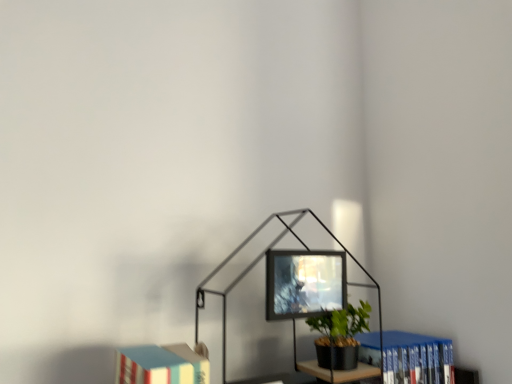
Looking at this image, in order to face hardcover book at lower left, which is the first book in front-to-back order, should I rotate leftwards or rightwards?

Turn left by 9.871 degrees to look at hardcover book at lower left, which is the first book in front-to-back order.

The image size is (512, 384). What do you see at coordinates (259, 261) in the screenshot?
I see `metallic black table lamp at center` at bounding box center [259, 261].

Locate an element on the screen. The height and width of the screenshot is (384, 512). hardcover book at lower left, which is the first book in front-to-back order is located at coordinates (161, 365).

Consider the image. Which object is positioned more to the right, blue hardcover book at lower right, the first book viewed from the back, or metallic black table lamp at center?

From the viewer's perspective, blue hardcover book at lower right, the first book viewed from the back, appears more on the right side.

Which of these two, blue hardcover book at lower right, positioned as the second book in front-to-back order, or metallic black table lamp at center, is thinner?

Thinner between the two is blue hardcover book at lower right, positioned as the second book in front-to-back order.

Measure the distance from blue hardcover book at lower right, the first book viewed from the back, to metallic black table lamp at center.

5.54 inches.

Could you tell me if blue hardcover book at lower right, positioned as the second book in front-to-back order, is turned towards metallic black table lamp at center?

No, blue hardcover book at lower right, positioned as the second book in front-to-back order, is not turned towards metallic black table lamp at center.

Between matte black monitor at center and metallic black table lamp at center, which one has smaller width?

matte black monitor at center.

Who is taller, matte black monitor at center or metallic black table lamp at center?

metallic black table lamp at center.

From the image's perspective, is matte black monitor at center positioned above or below metallic black table lamp at center?

Based on their image positions, matte black monitor at center is located above metallic black table lamp at center.

Is matte black monitor at center not near metallic black table lamp at center?

A: They are positioned close to each other.

Consider the image. Considering the relative sizes of matte black monitor at center and blue hardcover book at lower right, positioned as the 2th book in left-to-right order, in the image provided, is matte black monitor at center smaller than blue hardcover book at lower right, positioned as the 2th book in left-to-right order,?

Indeed, matte black monitor at center has a smaller size compared to blue hardcover book at lower right, positioned as the 2th book in left-to-right order.

Considering the sizes of objects matte black monitor at center and blue hardcover book at lower right, positioned as the second book in front-to-back order, in the image provided, who is shorter, matte black monitor at center or blue hardcover book at lower right, positioned as the second book in front-to-back order,?

matte black monitor at center is shorter.

Are matte black monitor at center and blue hardcover book at lower right, the 1th book from the right, located far from each other?

matte black monitor at center is near blue hardcover book at lower right, the 1th book from the right, not far away.

The width and height of the screenshot is (512, 384). Find the location of `book that appears behind the matte black monitor at center`. book that appears behind the matte black monitor at center is located at coordinates click(x=417, y=359).

Who is smaller, metallic black table lamp at center or matte black monitor at center?

Smaller between the two is matte black monitor at center.

Is metallic black table lamp at center at the right side of matte black monitor at center?

No.

Is metallic black table lamp at center next to matte black monitor at center and touching it?

Yes, metallic black table lamp at center is right next to matte black monitor at center and making contact.

In the scene shown: In the image, is blue hardcover book at lower right, the 1th book from the right, on the left side or the right side of hardcover book at lower left, which is the first book in front-to-back order?

blue hardcover book at lower right, the 1th book from the right, is to the right of hardcover book at lower left, which is the first book in front-to-back order.

Considering the sizes of blue hardcover book at lower right, positioned as the 2th book in left-to-right order, and hardcover book at lower left, which ranks as the second book in right-to-left order, in the image, is blue hardcover book at lower right, positioned as the 2th book in left-to-right order, wider or thinner than hardcover book at lower left, which ranks as the second book in right-to-left order,?

In the image, blue hardcover book at lower right, positioned as the 2th book in left-to-right order, appears to be more narrow than hardcover book at lower left, which ranks as the second book in right-to-left order.

Is blue hardcover book at lower right, the 1th book from the right, bigger or smaller than hardcover book at lower left, which ranks as the second book in right-to-left order?

Clearly, blue hardcover book at lower right, the 1th book from the right, is smaller in size than hardcover book at lower left, which ranks as the second book in right-to-left order.

Is matte black monitor at center beside hardcover book at lower left, which is the first book in front-to-back order?

No, matte black monitor at center is not touching hardcover book at lower left, which is the first book in front-to-back order.

Would you say matte black monitor at center is to the left or to the right of hardcover book at lower left, which is the first book in front-to-back order, in the picture?

From the image, it's evident that matte black monitor at center is to the right of hardcover book at lower left, which is the first book in front-to-back order.

Is matte black monitor at center positioned with its back to hardcover book at lower left, which ranks as the 1th book in left-to-right order?

No, matte black monitor at center is not facing the opposite direction of hardcover book at lower left, which ranks as the 1th book in left-to-right order.

Does matte black monitor at center lie behind hardcover book at lower left, which ranks as the second book in right-to-left order?

Yes, it is behind hardcover book at lower left, which ranks as the second book in right-to-left order.

Would you consider hardcover book at lower left, which is the first book in front-to-back order, to be distant from matte black monitor at center?

hardcover book at lower left, which is the first book in front-to-back order, is near matte black monitor at center, not far away.

Is hardcover book at lower left, which ranks as the second book in right-to-left order, not inside matte black monitor at center?

That's correct, hardcover book at lower left, which ranks as the second book in right-to-left order, is outside of matte black monitor at center.

From the image's perspective, which book is the 2nd one below the metallic black table lamp at center? Please provide its 2D coordinates.

[(417, 359)]

Locate an element on the screen. This screenshot has height=384, width=512. computer monitor lying on the right of metallic black table lamp at center is located at coordinates (304, 283).

Estimate the real-world distances between objects in this image. Which object is closer to hardcover book at lower left, which appears as the second book when viewed from the back, blue hardcover book at lower right, the first book viewed from the back, or matte black monitor at center?

matte black monitor at center.

When comparing their distances from metallic black table lamp at center, does hardcover book at lower left, which ranks as the second book in right-to-left order, or matte black monitor at center seem further?

Among the two, hardcover book at lower left, which ranks as the second book in right-to-left order, is located further to metallic black table lamp at center.

Considering their positions, is matte black monitor at center positioned closer to hardcover book at lower left, which ranks as the second book in right-to-left order, than blue hardcover book at lower right, positioned as the 2th book in left-to-right order?

matte black monitor at center lies closer to hardcover book at lower left, which ranks as the second book in right-to-left order, than the other object.

Looking at this image, based on their spatial positions, is metallic black table lamp at center or hardcover book at lower left, which ranks as the 1th book in left-to-right order, closer to matte black monitor at center?

Based on the image, metallic black table lamp at center appears to be nearer to matte black monitor at center.

Looking at this image, from the image, which object appears to be nearer to metallic black table lamp at center, matte black monitor at center or hardcover book at lower left, which appears as the second book when viewed from the back?

matte black monitor at center lies closer to metallic black table lamp at center than the other object.

Estimate the real-world distances between objects in this image. Which object is closer to metallic black table lamp at center, matte black monitor at center or blue hardcover book at lower right, positioned as the second book in front-to-back order?

The object closer to metallic black table lamp at center is matte black monitor at center.

From the image, which object appears to be farther from hardcover book at lower left, which appears as the second book when viewed from the back, metallic black table lamp at center or matte black monitor at center?

matte black monitor at center lies further to hardcover book at lower left, which appears as the second book when viewed from the back, than the other object.

From the image, which object appears to be nearer to blue hardcover book at lower right, positioned as the 2th book in left-to-right order, metallic black table lamp at center or matte black monitor at center?

metallic black table lamp at center.

The width and height of the screenshot is (512, 384). I want to click on computer monitor between hardcover book at lower left, which ranks as the second book in right-to-left order, and blue hardcover book at lower right, positioned as the second book in front-to-back order, so click(x=304, y=283).

This screenshot has height=384, width=512. I want to click on computer monitor between metallic black table lamp at center and blue hardcover book at lower right, the 1th book from the right, so click(x=304, y=283).

Find the location of `table lamp between hardcover book at lower left, which ranks as the 1th book in left-to-right order, and matte black monitor at center, in the horizontal direction`. table lamp between hardcover book at lower left, which ranks as the 1th book in left-to-right order, and matte black monitor at center, in the horizontal direction is located at coordinates (259, 261).

Find the location of a particular element. The width and height of the screenshot is (512, 384). table lamp between hardcover book at lower left, which ranks as the 1th book in left-to-right order, and blue hardcover book at lower right, the 1th book from the right, in the horizontal direction is located at coordinates (259, 261).